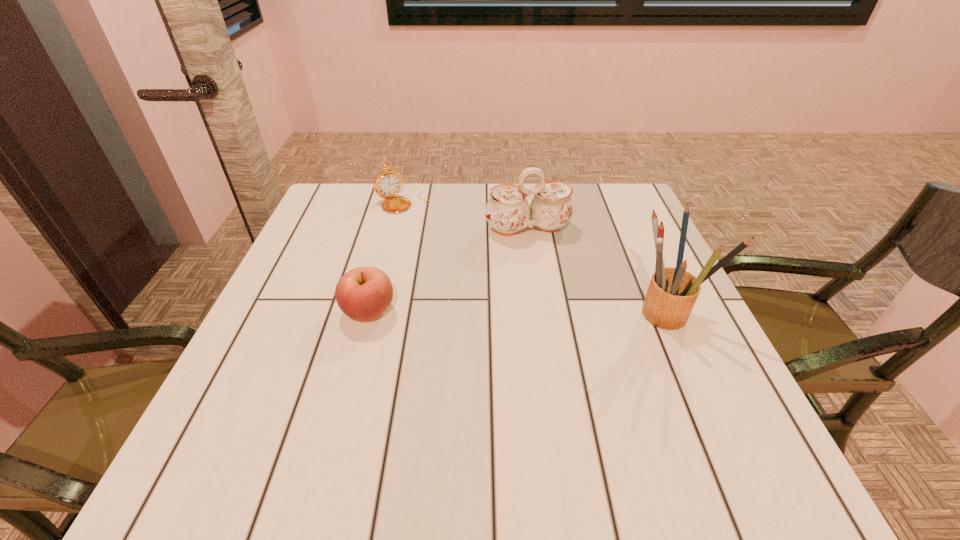
The image size is (960, 540). I want to click on vacant point located 0.380m on the face of the pocket watch, so click(492, 292).

Where is `free spot located 0.250m by the handle of the second object from right to left`? This screenshot has height=540, width=960. free spot located 0.250m by the handle of the second object from right to left is located at coordinates (564, 315).

Where is `vacant space located by the handle of the second object from right to left`? vacant space located by the handle of the second object from right to left is located at coordinates (579, 353).

In order to click on free spot located by the handle of the second object from right to left in this screenshot , I will do `click(541, 255)`.

Where is `pocket watch that is positioned at the far edge`? pocket watch that is positioned at the far edge is located at coordinates (387, 184).

This screenshot has height=540, width=960. Identify the location of chinaware present at the far edge. (507, 211).

You are a GUI agent. You are given a task and a screenshot of the screen. Output one action in this format:
    pyautogui.click(x=<x>, y=<y>)
    Task: Click on the apple present at the left edge
    
    Given the screenshot: What is the action you would take?
    pyautogui.click(x=364, y=293)

This screenshot has height=540, width=960. In order to click on pocket watch at the left edge in this screenshot , I will do `click(387, 184)`.

The height and width of the screenshot is (540, 960). I want to click on object that is at the right edge, so click(672, 292).

Locate an element on the screen. The width and height of the screenshot is (960, 540). object located in the far left corner section of the desktop is located at coordinates (387, 184).